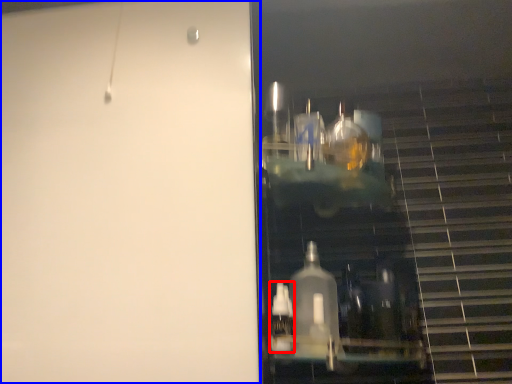
Question: Which of the following is the farthest to the observer, bottle (highlighted by a red box) or door (highlighted by a blue box)?

Choices:
 (A) bottle
 (B) door

Answer: (A)